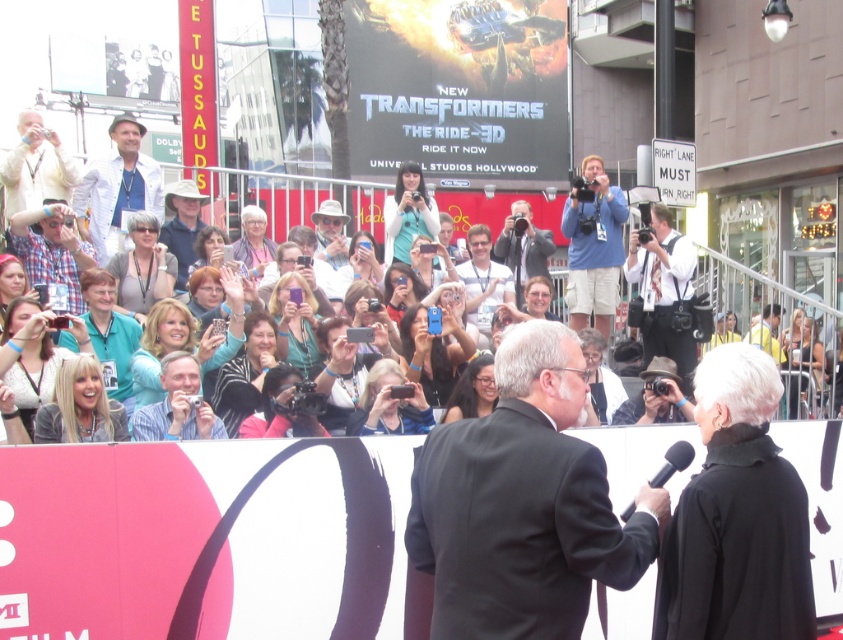
The width and height of the screenshot is (843, 640). What do you see at coordinates (524, 246) in the screenshot?
I see `matte black camera at upper center` at bounding box center [524, 246].

Who is shorter, matte black camera at upper center or yellow shirt at center?

yellow shirt at center

Who is more forward, (500, 236) or (763, 308)?

Point (500, 236) is in front.

Where is `matte black camera at upper center`? matte black camera at upper center is located at coordinates (524, 246).

Measure the distance between point (439, 513) and camera.

They are 8.10 meters apart.

Which is more to the left, black suit at center or matte black camera at upper center?

From the viewer's perspective, black suit at center appears more on the left side.

Is point (556, 488) behind point (530, 246)?

No, (556, 488) is closer to viewer.

Locate an element on the screen. black suit at center is located at coordinates (519, 508).

Is white matte shirt at upper center smaller than matte black camera at upper center?

Incorrect, white matte shirt at upper center is not smaller in size than matte black camera at upper center.

Between white matte shirt at upper center and matte black camera at upper center, which one is positioned higher?

white matte shirt at upper center is higher up.

Measure the distance between white matte shirt at upper center and camera.

white matte shirt at upper center and camera are 16.76 meters apart.

What are the coordinates of `white matte shirt at upper center` in the screenshot? It's located at point(117,186).